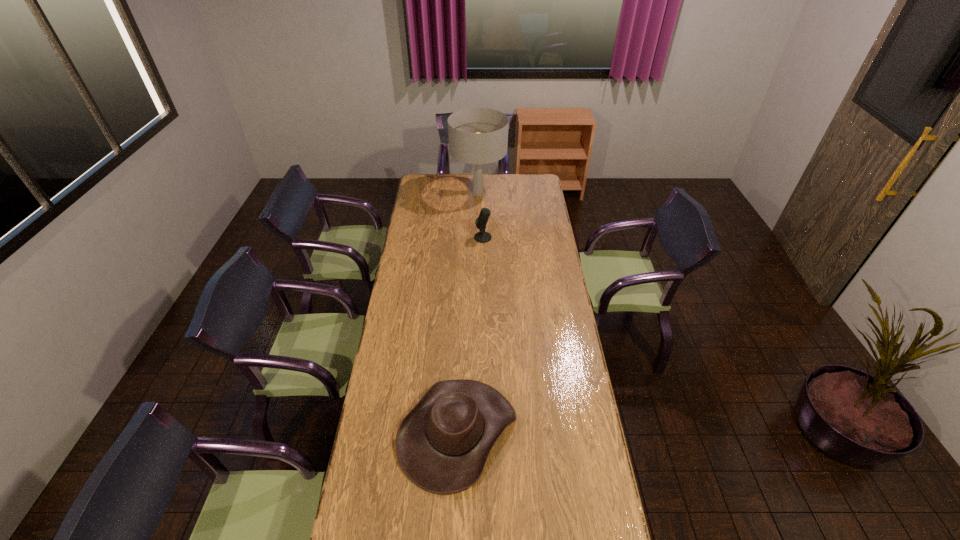
This screenshot has width=960, height=540. In order to click on object present at the left edge in this screenshot , I will do `click(442, 444)`.

The height and width of the screenshot is (540, 960). What are the coordinates of `blank area at the far edge` in the screenshot? It's located at (486, 180).

Image resolution: width=960 pixels, height=540 pixels. I want to click on free region at the left edge of the desktop, so click(x=363, y=501).

Locate an element on the screen. This screenshot has width=960, height=540. free space at the right edge of the desktop is located at coordinates (528, 262).

Find the location of a particular element. This screenshot has height=540, width=960. blank space at the far left corner is located at coordinates (424, 191).

Locate an element on the screen. vacant space at the far right corner is located at coordinates (520, 184).

What are the coordinates of `vacant area that lies between the shortest object and the tallest object` in the screenshot? It's located at (468, 312).

The height and width of the screenshot is (540, 960). Find the location of `vacant space that is in between the shortest object and the farthest object`. vacant space that is in between the shortest object and the farthest object is located at coordinates (468, 312).

Choose which object is the second nearest neighbor to the tallest object. Please provide its 2D coordinates. Your answer should be formatted as a tuple, i.e. [(x, y)], where the tuple contains the x and y coordinates of a point satisfying the conditions above.

[(442, 444)]

Where is `the closest object to the shortest object`? The image size is (960, 540). the closest object to the shortest object is located at coordinates (482, 237).